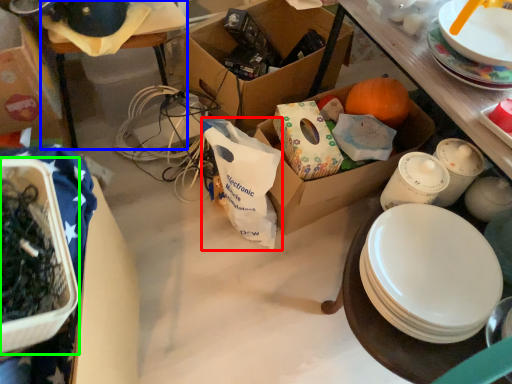
Question: Which object is positioned closest to shopping bag (highlighted by a red box)? Select from table (highlighted by a blue box) and box (highlighted by a green box).

Choices:
 (A) table
 (B) box

Answer: (A)